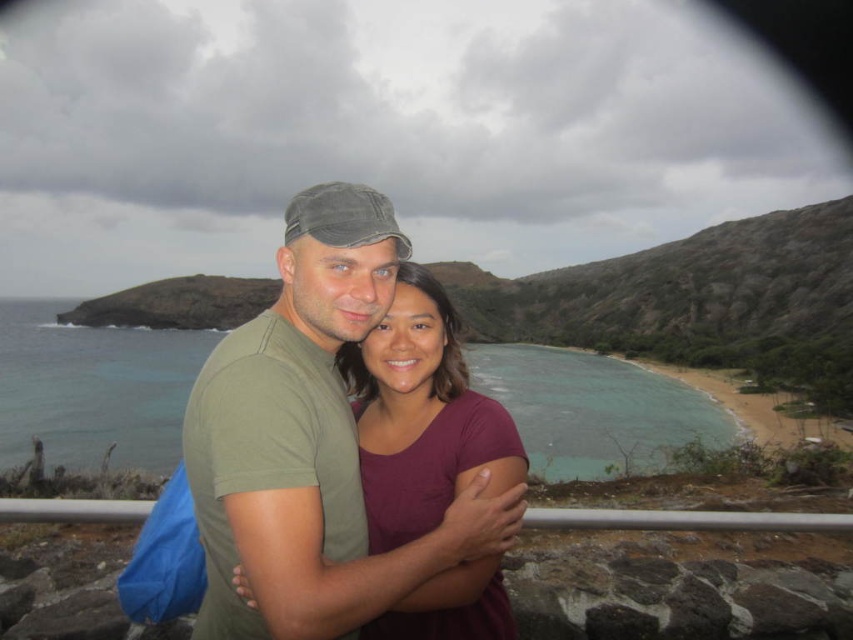
Measure the distance between greenish-blue water at center and maroon fabric shirt at center.

greenish-blue water at center is 52.42 meters from maroon fabric shirt at center.

Identify the location of greenish-blue water at center. (91, 388).

In order to click on greenish-blue water at center in this screenshot , I will do `click(91, 388)`.

Measure the distance between matte green t-shirt at center and maroon fabric shirt at center.

The distance of matte green t-shirt at center from maroon fabric shirt at center is 1.04 meters.

Between point (341, 468) and point (473, 436), which one is positioned behind?

Positioned behind is point (473, 436).

The image size is (853, 640). I want to click on matte green t-shirt at center, so click(x=310, y=444).

Is the position of matte green t-shirt at center less distant than that of greenish-blue water at center?

Yes.

Is matte green t-shirt at center behind greenish-blue water at center?

No, it is not.

Is point (183, 426) closer to viewer compared to point (154, 376)?

Yes, point (183, 426) is in front of point (154, 376).

Locate an element on the screen. matte green t-shirt at center is located at coordinates (310, 444).